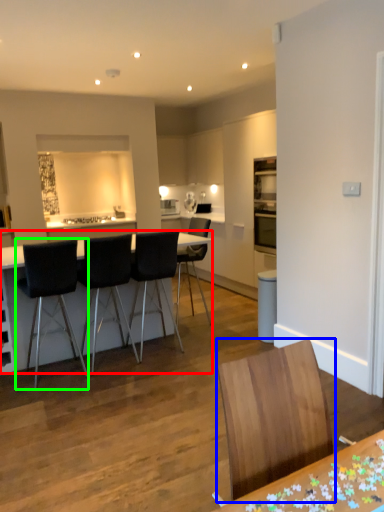
Question: Based on their relative distances, which object is nearer to table (highlighted by a red box)? Choose from chair (highlighted by a blue box) and chair (highlighted by a green box).

Choices:
 (A) chair
 (B) chair

Answer: (B)